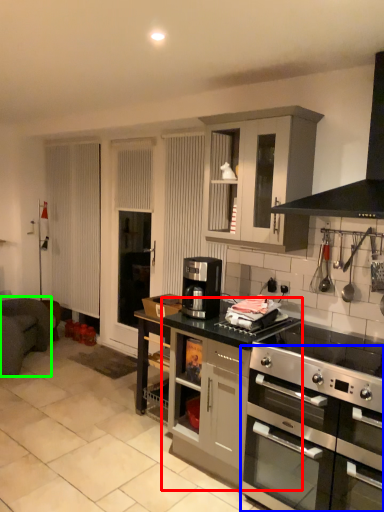
Question: Which object is positioned closest to cabinetry (highlighted by a red box)? Select from oven (highlighted by a blue box) and armchair (highlighted by a green box).

Choices:
 (A) oven
 (B) armchair

Answer: (A)